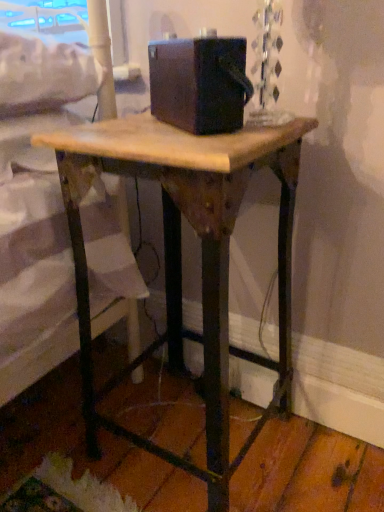
Question: In terms of height, does matte black box at center look taller or shorter compared to wooden table at center?

Choices:
 (A) tall
 (B) short

Answer: (B)

Question: Choose the correct answer: Is matte black box at center inside wooden table at center or outside it?

Choices:
 (A) outside
 (B) inside

Answer: (A)

Question: Considering their positions, is matte black box at center located in front of or behind wooden table at center?

Choices:
 (A) behind
 (B) front

Answer: (A)

Question: Choose the correct answer: Is wooden table at center inside matte black box at center or outside it?

Choices:
 (A) outside
 (B) inside

Answer: (A)

Question: From the image's perspective, is wooden table at center located above or below matte black box at center?

Choices:
 (A) below
 (B) above

Answer: (A)

Question: Considering the positions of wooden table at center and matte black box at center in the image, is wooden table at center wider or thinner than matte black box at center?

Choices:
 (A) wide
 (B) thin

Answer: (A)

Question: From their relative heights in the image, would you say wooden table at center is taller or shorter than matte black box at center?

Choices:
 (A) short
 (B) tall

Answer: (B)